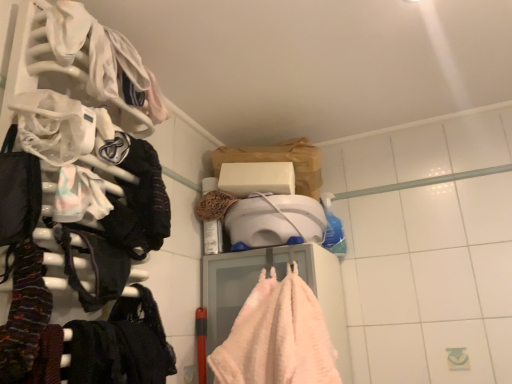
Question: Would you say white plastic hanger at left is inside or outside pastel cotton bib at left, which ranks as the second clothing in front-to-back order?

Choices:
 (A) outside
 (B) inside

Answer: (A)

Question: Based on their sizes in the image, would you say white plastic hanger at left is bigger or smaller than pastel cotton bib at left, which ranks as the 1th clothing in back-to-front order?

Choices:
 (A) small
 (B) big

Answer: (B)

Question: Which is farther from the pastel cotton bib at left, which appears as the first clothing when viewed from the top?

Choices:
 (A) knitted wool scarf at left, marked as the 2th clothing in a top-to-bottom arrangement
 (B) white plastic hanger at left

Answer: (A)

Question: Which of these objects is positioned closest to the pastel cotton bib at left, the second clothing from the bottom?

Choices:
 (A) white plastic hanger at left
 (B) knitted wool scarf at left, the 2th clothing viewed from the back

Answer: (A)